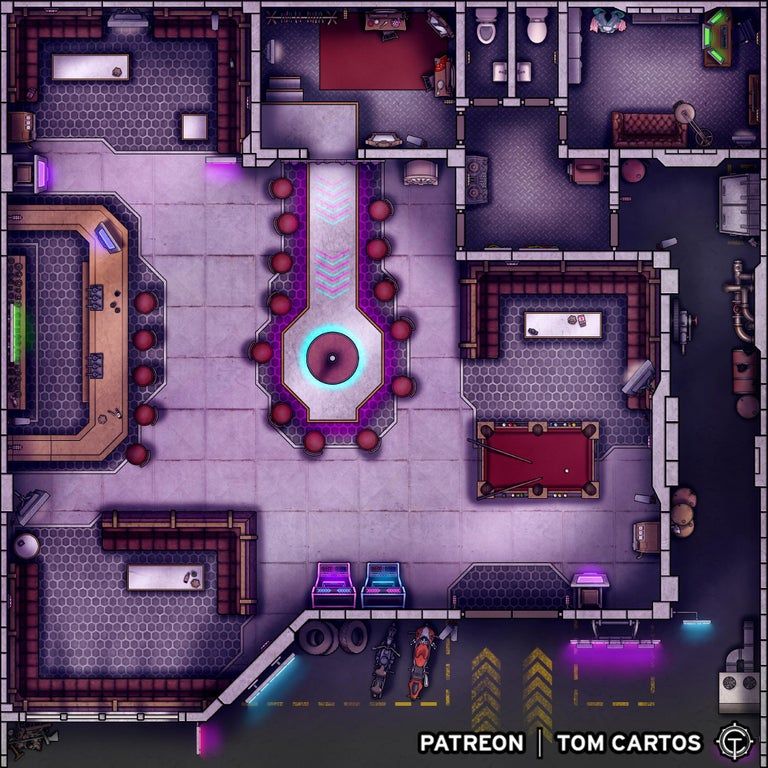
Find the location of a particular element. table is located at coordinates (164, 581), (103, 342), (555, 435), (567, 326), (61, 65), (187, 124).